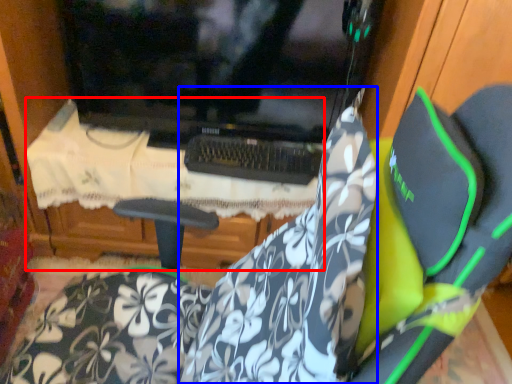
Question: Among these objects, which one is farthest to the camera, table (highlighted by a red box) or fabric (highlighted by a blue box)?

Choices:
 (A) table
 (B) fabric

Answer: (A)